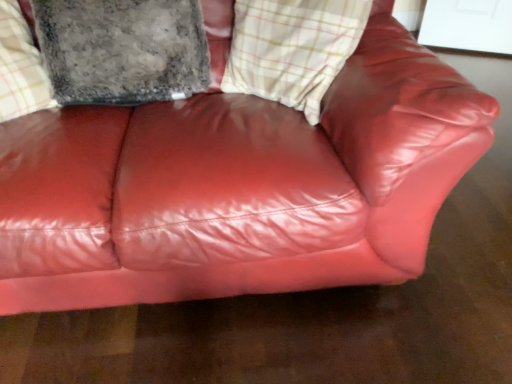
At what (x,y) coordinates should I click in order to perform the action: click on fuzzy gray pillow at upper left. Please return your answer as a coordinate pair (x, y). The width and height of the screenshot is (512, 384). Looking at the image, I should click on (122, 50).

This screenshot has width=512, height=384. What do you see at coordinates (122, 50) in the screenshot?
I see `fuzzy gray pillow at upper left` at bounding box center [122, 50].

Measure the distance between plaid fabric cushion at upper center and camera.

1.04 meters.

What is the approximate height of plaid fabric cushion at upper center?

The height of plaid fabric cushion at upper center is 15.97 inches.

This screenshot has height=384, width=512. What do you see at coordinates (292, 49) in the screenshot?
I see `plaid fabric cushion at upper center` at bounding box center [292, 49].

Find the location of a particular element. The width and height of the screenshot is (512, 384). plaid fabric cushion at upper center is located at coordinates (292, 49).

Find the location of `fuzzy gray pillow at upper left`. fuzzy gray pillow at upper left is located at coordinates (122, 50).

Is fuzzy gray pillow at upper left to the right of plaid fabric cushion at upper center from the viewer's perspective?

Incorrect, fuzzy gray pillow at upper left is not on the right side of plaid fabric cushion at upper center.

Does fuzzy gray pillow at upper left lie behind plaid fabric cushion at upper center?

Yes, fuzzy gray pillow at upper left is further from the camera.

Is point (92, 96) positioned in front of point (335, 30)?

No, (92, 96) is further to viewer.

From the image's perspective, does fuzzy gray pillow at upper left appear lower than plaid fabric cushion at upper center?

No, from the image's perspective, fuzzy gray pillow at upper left is not below plaid fabric cushion at upper center.

From a real-world perspective, is fuzzy gray pillow at upper left physically below plaid fabric cushion at upper center?

Incorrect, from a real-world perspective, fuzzy gray pillow at upper left is higher than plaid fabric cushion at upper center.

Considering the sizes of objects fuzzy gray pillow at upper left and plaid fabric cushion at upper center in the image provided, who is wider, fuzzy gray pillow at upper left or plaid fabric cushion at upper center?

fuzzy gray pillow at upper left is wider.

Is fuzzy gray pillow at upper left taller than plaid fabric cushion at upper center?

In fact, fuzzy gray pillow at upper left may be shorter than plaid fabric cushion at upper center.

Between fuzzy gray pillow at upper left and plaid fabric cushion at upper center, which one has larger size?

fuzzy gray pillow at upper left is bigger.

Is fuzzy gray pillow at upper left situated inside plaid fabric cushion at upper center or outside?

fuzzy gray pillow at upper left lies outside plaid fabric cushion at upper center.

Is fuzzy gray pillow at upper left placed right next to plaid fabric cushion at upper center?

fuzzy gray pillow at upper left and plaid fabric cushion at upper center are clearly separated.

Could you tell me if fuzzy gray pillow at upper left is facing plaid fabric cushion at upper center?

No.

What's the angular difference between fuzzy gray pillow at upper left and plaid fabric cushion at upper center's facing directions?

The angle between the facing direction of fuzzy gray pillow at upper left and the facing direction of plaid fabric cushion at upper center is 51.4 degrees.

Measure the distance between fuzzy gray pillow at upper left and plaid fabric cushion at upper center.

fuzzy gray pillow at upper left and plaid fabric cushion at upper center are 29.08 centimeters apart from each other.

Locate an element on the screen. The width and height of the screenshot is (512, 384). plaid located on the right of fuzzy gray pillow at upper left is located at coordinates (292, 49).

Considering the positions of objects plaid fabric cushion at upper center and fuzzy gray pillow at upper left in the image provided, who is more to the left, plaid fabric cushion at upper center or fuzzy gray pillow at upper left?

fuzzy gray pillow at upper left is more to the left.

Considering the relative positions of plaid fabric cushion at upper center and fuzzy gray pillow at upper left in the image provided, is plaid fabric cushion at upper center in front of fuzzy gray pillow at upper left?

Yes, plaid fabric cushion at upper center is in front of fuzzy gray pillow at upper left.

Is point (245, 19) less distant than point (71, 55)?

No.

From the image's perspective, which is above, plaid fabric cushion at upper center or fuzzy gray pillow at upper left?

fuzzy gray pillow at upper left appears higher in the image.

From a real-world perspective, between plaid fabric cushion at upper center and fuzzy gray pillow at upper left, who is vertically higher?

fuzzy gray pillow at upper left is physically above.

Based on the photo, which of these two, plaid fabric cushion at upper center or fuzzy gray pillow at upper left, is wider?

fuzzy gray pillow at upper left is wider.

Between plaid fabric cushion at upper center and fuzzy gray pillow at upper left, which one has more height?

plaid fabric cushion at upper center is taller.

Does plaid fabric cushion at upper center have a larger size compared to fuzzy gray pillow at upper left?

Actually, plaid fabric cushion at upper center might be smaller than fuzzy gray pillow at upper left.

Is plaid fabric cushion at upper center not within fuzzy gray pillow at upper left?

Yes, plaid fabric cushion at upper center is located beyond the bounds of fuzzy gray pillow at upper left.

Is plaid fabric cushion at upper center beside fuzzy gray pillow at upper left?

plaid fabric cushion at upper center is not next to fuzzy gray pillow at upper left, and they're not touching.

Is plaid fabric cushion at upper center oriented away from fuzzy gray pillow at upper left?

No, fuzzy gray pillow at upper left is not at the back of plaid fabric cushion at upper center.

How far apart are plaid fabric cushion at upper center and fuzzy gray pillow at upper left?

plaid fabric cushion at upper center and fuzzy gray pillow at upper left are 29.08 centimeters apart from each other.

Where is `pillow above the plaid fabric cushion at upper center (from a real-world perspective)`? pillow above the plaid fabric cushion at upper center (from a real-world perspective) is located at coordinates (122, 50).

Locate an element on the screen. pillow above the plaid fabric cushion at upper center (from the image's perspective) is located at coordinates (122, 50).

The height and width of the screenshot is (384, 512). What are the coordinates of `plaid that appears below the fuzzy gray pillow at upper left (from a real-world perspective)` in the screenshot? It's located at (292, 49).